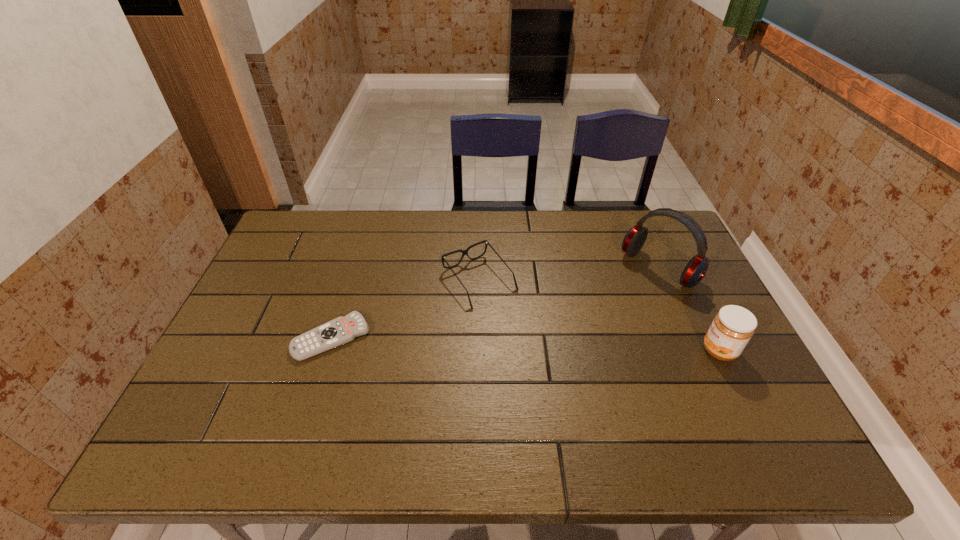
Find the location of a particular element. The width and height of the screenshot is (960, 540). remote control is located at coordinates (341, 330).

This screenshot has width=960, height=540. Find the location of `the shortest object`. the shortest object is located at coordinates (341, 330).

Locate an element on the screen. This screenshot has width=960, height=540. jam is located at coordinates (732, 328).

This screenshot has height=540, width=960. What are the coordinates of `spectacles` in the screenshot? It's located at (464, 252).

The height and width of the screenshot is (540, 960). Identify the location of the third tallest object. (464, 252).

I want to click on earphone, so click(x=696, y=269).

This screenshot has width=960, height=540. I want to click on vacant space situated 0.350m on the right of the shortest object, so click(502, 338).

At what (x,y) coordinates should I click in order to perform the action: click on vacant space situated 0.050m on the front label of the second tallest object. Please return your answer as a coordinate pair (x, y). The width and height of the screenshot is (960, 540). Looking at the image, I should click on (683, 350).

The image size is (960, 540). Find the location of `vacant area situated 0.270m on the front label of the second tallest object`. vacant area situated 0.270m on the front label of the second tallest object is located at coordinates (596, 350).

What are the coordinates of `vacant space located 0.160m on the front label of the second tallest object` in the screenshot? It's located at (639, 350).